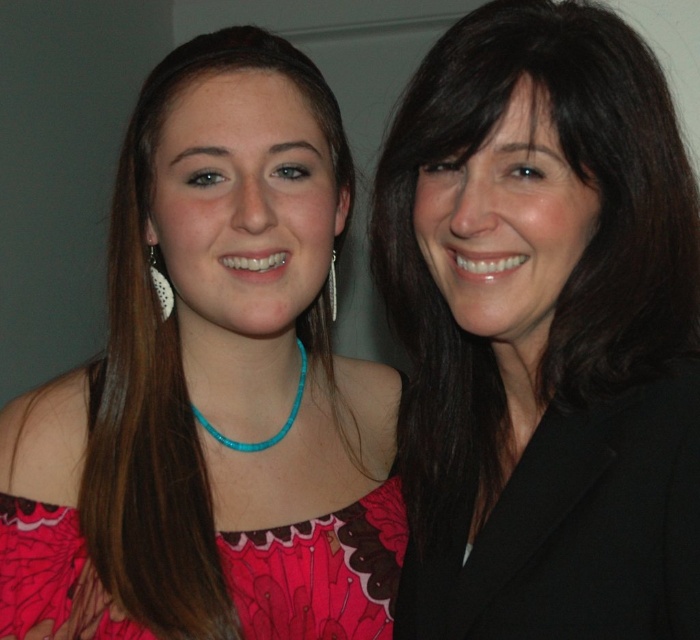
You are taking a photo of two people standing in front of you. You notice two points in the image labeled as point (x=616, y=172) and point (x=141, y=566). Which point is nearer to your camera?

Point (x=616, y=172) is closer to the camera than point (x=141, y=566).

You are a photographer who needs to adjust the lighting to ensure both the black glossy hair at right and the pink fabric dress at center are well lit. Which object should you focus the light on first, the one closer to the camera or the one further away?

The black glossy hair at right is shorter than the pink fabric dress at center, meaning the dress is closer to the camera. Therefore, you should focus the light on the pink fabric dress at center first since it is nearer and requires proper illumination before adjusting for the hair which is further back.